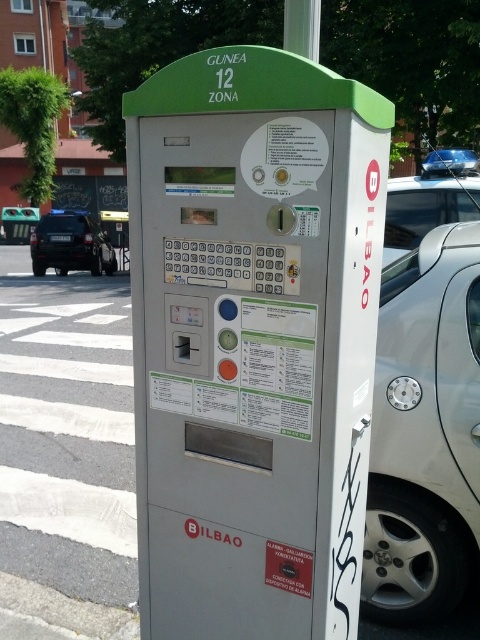
You are a pedestrian trying to find the parking meter to pay for your car. You see a white plastic pole at upper center and a metallic gray parking meter at center. Which object is closer to the left side of the image?

The metallic gray parking meter at center is to the left of the white plastic pole at upper center, so it is closer to the left side of the image.

You are a delivery driver who needs to park your van near the metallic gray parking meter at center. Your van is 10 feet long. There is a white plastic pole at upper center nearby. Can you safely park your van between the pole and the parking meter without hitting either object?

The distance between the metallic gray parking meter at center and the white plastic pole at upper center is 3.52 feet. Since your van is 10 feet long, it cannot fit in the space between them. You need to find another parking spot.

You are standing at the center of the street and see the metallic gray parking meter at center. If you walk straight towards it, will you reach it before reaching the street corner?

The metallic gray parking meter at center is located at point (252,340), which is near the center of the image. Since you are already at the center of the street, walking straight towards it would mean you are already at the parking meter. Therefore, you are already at the parking meter and do not need to walk further.